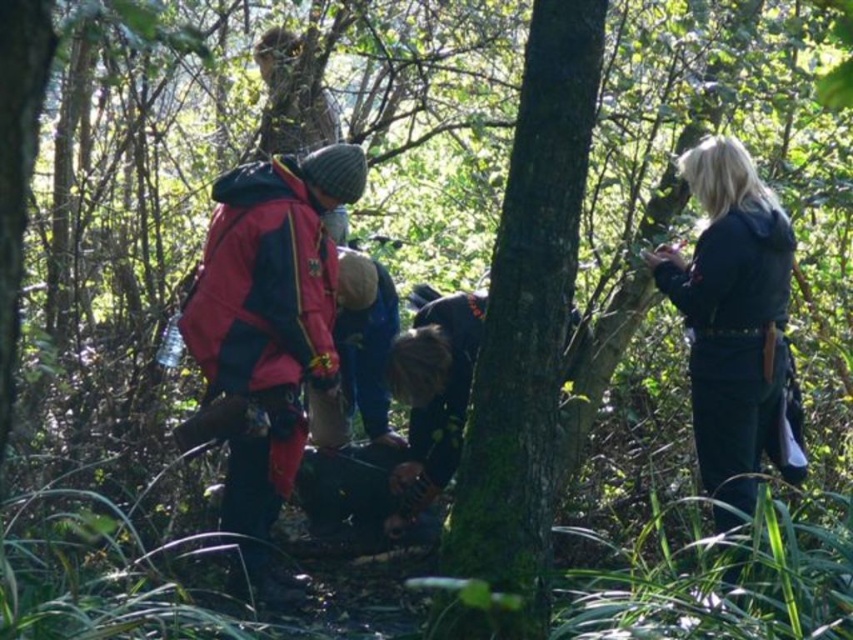
Consider the image. You are a hiker who needs to pass between the red fabric jacket at center and the black matte jacket at right. Your backpack adds 0.5 meters to your width. Can you safely pass through the space between them without touching either?

The distance between the red fabric jacket at center and the black matte jacket at right is 2.24 meters. Since your backpack adds 0.5 meters to your width, you need at least 0.5 meters of space. The available space is more than sufficient, so you can safely pass through without touching either.